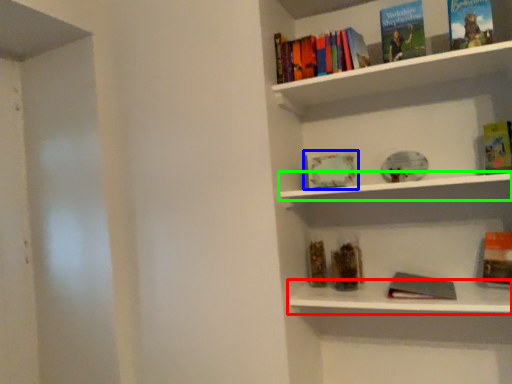
Question: Considering the real-world distances, which object is farthest from window sill (highlighted by a red box)? book (highlighted by a blue box) or window sill (highlighted by a green box)?

Choices:
 (A) book
 (B) window sill

Answer: (A)